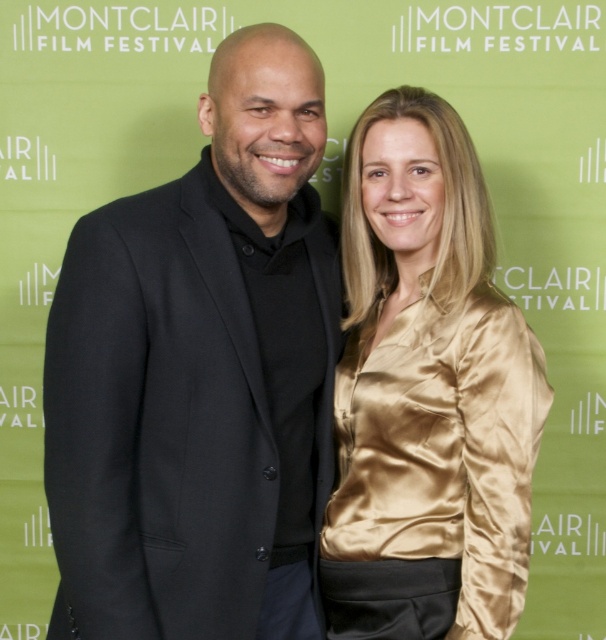
You are a photographer at the Montclair Film Festival. You need to capture a clear photo of both the black wool suit at center and the gold satin blouse at center. However, the backdrop has the festival name written all over it. Can you adjust your camera angle so that both items are visible without the text overlapping them?

The black wool suit at center is positioned over the gold satin blouse at center, so adjusting the camera angle might not fully eliminate the text overlapping both items since they are layered on top of each other. However, tilting the camera slightly downward could help focus on the lower part of the gold satin blouse at center where the text might be less dense.

You are a photographer at the Montclair Film Festival. You need to place a red ribbon exactly at the center of the black wool suit at center. According to the coordinates provided, where should you place the ribbon?

The red ribbon should be placed at the coordinates point (201, 374), which is the center of the black wool suit at center.

You are a photographer at the Montclair Film Festival. You want to ensure that the black wool suit at center and the gold satin blouse at center are both clearly visible in your photo. Given that your camera has a depth of field that can sharply focus on objects within a 10 inch range, will both items remain in focus if you focus on the midpoint between them?

The black wool suit at center is 8.65 inches from the gold satin blouse at center. If you focus on the midpoint between them, the distance from each to the focus point is about 4.325 inches. Since the depth of field can cover 10 inches, both items will remain in focus as their distances from the focus point are within the 10 inch range.